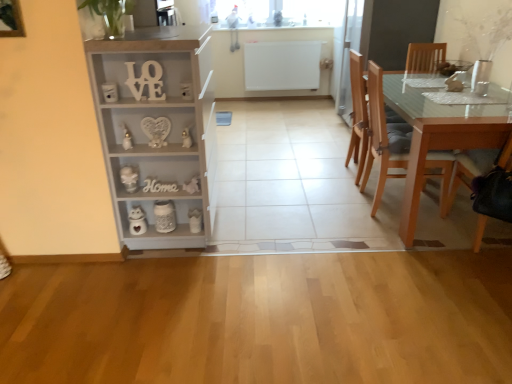
Question: Is light gray wood cabinet at left not close to white matte wooden letters at upper center?

Choices:
 (A) no
 (B) yes

Answer: (A)

Question: Are light gray wood cabinet at left and white matte wooden letters at upper center making contact?

Choices:
 (A) no
 (B) yes

Answer: (A)

Question: Does light gray wood cabinet at left come in front of white matte wooden letters at upper center?

Choices:
 (A) no
 (B) yes

Answer: (B)

Question: Does light gray wood cabinet at left appear on the right side of white matte wooden letters at upper center?

Choices:
 (A) no
 (B) yes

Answer: (B)

Question: Is light gray wood cabinet at left smaller than white matte wooden letters at upper center?

Choices:
 (A) yes
 (B) no

Answer: (B)

Question: From a real-world perspective, is light gray wood cabinet at left below white matte wooden letters at upper center?

Choices:
 (A) yes
 (B) no

Answer: (A)

Question: Is light brown wooden table at right closer to camera compared to white matte wooden letters at upper center?

Choices:
 (A) no
 (B) yes

Answer: (A)

Question: From a real-world perspective, is light brown wooden table at right over white matte wooden letters at upper center?

Choices:
 (A) no
 (B) yes

Answer: (A)

Question: Is light brown wooden table at right smaller than white matte wooden letters at upper center?

Choices:
 (A) no
 (B) yes

Answer: (A)

Question: Could white matte wooden letters at upper center be considered to be inside light brown wooden table at right?

Choices:
 (A) no
 (B) yes

Answer: (A)

Question: From the image's perspective, is light brown wooden table at right over white matte wooden letters at upper center?

Choices:
 (A) no
 (B) yes

Answer: (A)

Question: Is light brown wooden table at right at the right side of white matte wooden letters at upper center?

Choices:
 (A) yes
 (B) no

Answer: (A)

Question: Is the position of light brown wooden chair at right, the 2th chair from the front, more distant than that of wooden chair at right, placed as the first chair when sorted from front to back?

Choices:
 (A) no
 (B) yes

Answer: (B)